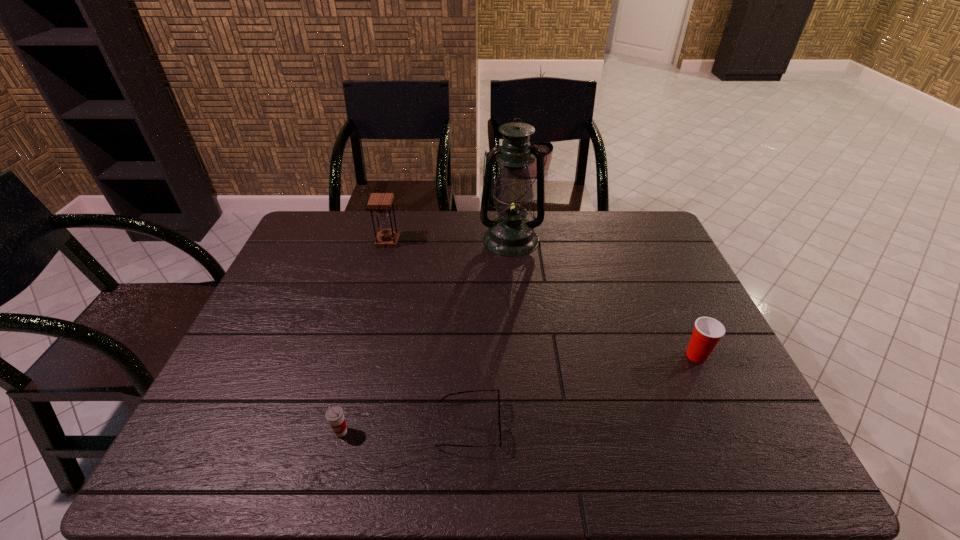
Where is `free space located 0.190m on the face of the shortest object`? The height and width of the screenshot is (540, 960). free space located 0.190m on the face of the shortest object is located at coordinates (586, 426).

Identify the location of oil lamp at the far edge. The height and width of the screenshot is (540, 960). (511, 234).

You are a GUI agent. You are given a task and a screenshot of the screen. Output one action in this format:
    pyautogui.click(x=<x>, y=<y>)
    Task: Click on the hourglass situated at the far edge
    
    Given the screenshot: What is the action you would take?
    pyautogui.click(x=381, y=202)

Locate an element on the screen. This screenshot has width=960, height=540. cup that is positioned at the near edge is located at coordinates (335, 416).

I want to click on spectacles positioned at the near edge, so click(499, 422).

I want to click on object that is at the right edge, so click(708, 331).

Find the location of a particular element. This screenshot has width=960, height=540. blank space at the far edge of the desktop is located at coordinates (352, 227).

You are a GUI agent. You are given a task and a screenshot of the screen. Output one action in this format:
    pyautogui.click(x=<x>, y=<y>)
    Task: Click on the free location at the near edge
    
    Given the screenshot: What is the action you would take?
    pyautogui.click(x=334, y=469)

Where is `free region at the left edge of the desktop`? free region at the left edge of the desktop is located at coordinates (278, 309).

The width and height of the screenshot is (960, 540). What are the coordinates of `vacant space at the right edge of the desktop` in the screenshot? It's located at (667, 277).